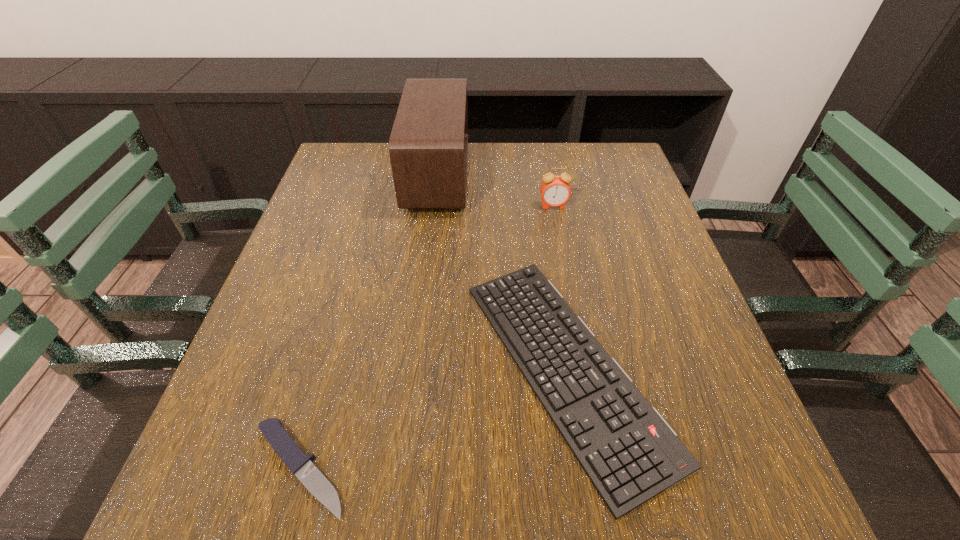
The image size is (960, 540). I want to click on unoccupied area between the second shortest object and the shortest object, so click(x=433, y=418).

Where is `object that is the closest to the radio receiver`? This screenshot has width=960, height=540. object that is the closest to the radio receiver is located at coordinates (629, 452).

Identify which object is the closest to the second shortest object. Please provide its 2D coordinates. Your answer should be formatted as a tuple, i.e. [(x, y)], where the tuple contains the x and y coordinates of a point satisfying the conditions above.

[(301, 465)]

The image size is (960, 540). Find the location of `blank space that satisfies the following two spatial constraints: 1. on the front-facing side of the tallest object; 2. on the left side of the second shortest object`. blank space that satisfies the following two spatial constraints: 1. on the front-facing side of the tallest object; 2. on the left side of the second shortest object is located at coordinates (415, 367).

You are a GUI agent. You are given a task and a screenshot of the screen. Output one action in this format:
    pyautogui.click(x=<x>, y=<y>)
    Task: Click on the free space that satisfies the following two spatial constraints: 1. on the front-facing side of the radio receiver; 2. on the left side of the computer keyboard
    This screenshot has height=540, width=960.
    Given the screenshot: What is the action you would take?
    pyautogui.click(x=415, y=367)